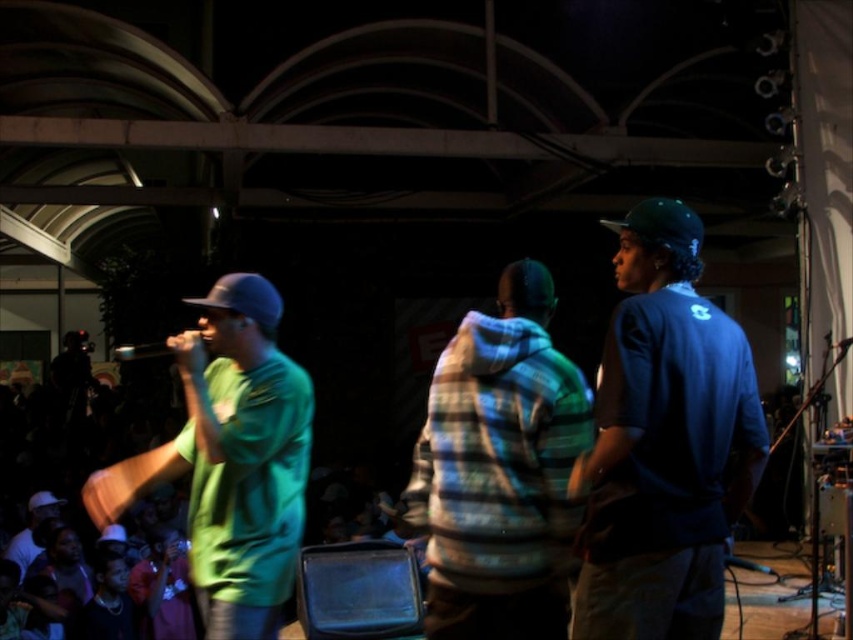
Question: Which object is the closest to the blue matte shirt at center?

Choices:
 (A) green matte shirt at center
 (B) plaid fleece jacket at center

Answer: (B)

Question: Is blue matte shirt at center bigger than green matte shirt at center?

Choices:
 (A) no
 (B) yes

Answer: (B)

Question: Among these points, which one is nearest to the camera?

Choices:
 (A) (x=575, y=611)
 (B) (x=212, y=428)

Answer: (A)

Question: Where is blue matte shirt at center located in relation to plaid fleece jacket at center in the image?

Choices:
 (A) left
 (B) right

Answer: (B)

Question: Estimate the real-world distances between objects in this image. Which object is closer to the plaid fleece jacket at center?

Choices:
 (A) green matte shirt at center
 (B) blue matte shirt at center

Answer: (B)

Question: Is blue matte shirt at center wider than plaid fleece jacket at center?

Choices:
 (A) no
 (B) yes

Answer: (A)